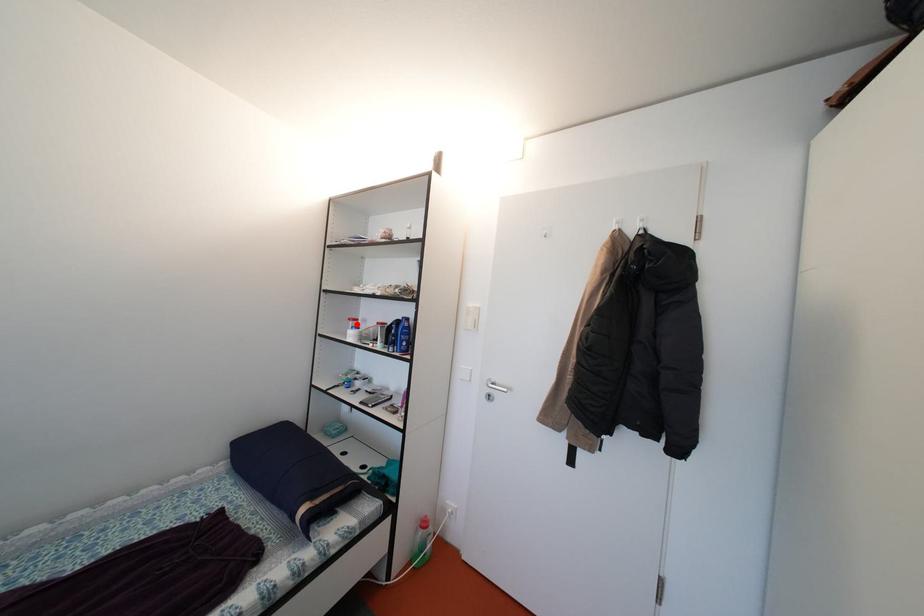
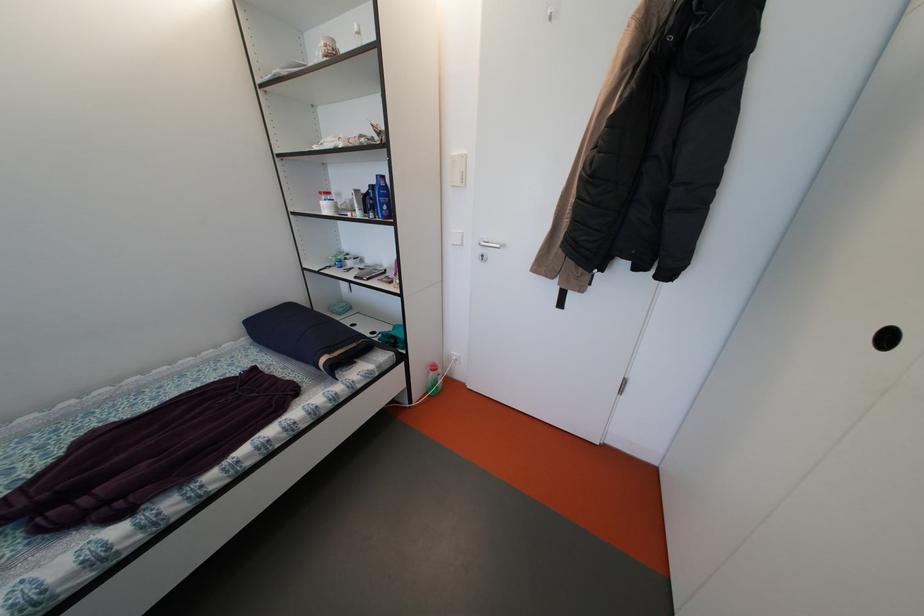
The point at the highlighted location is marked in the first image. Where is the corresponding point in the second image?

(327, 198)